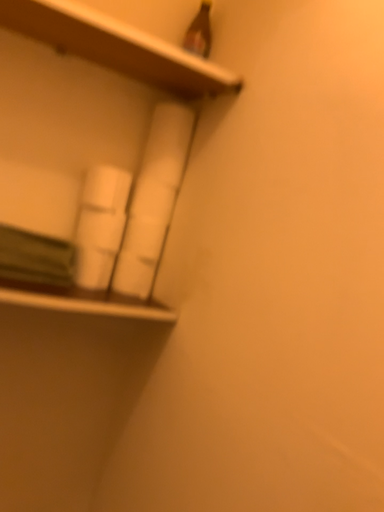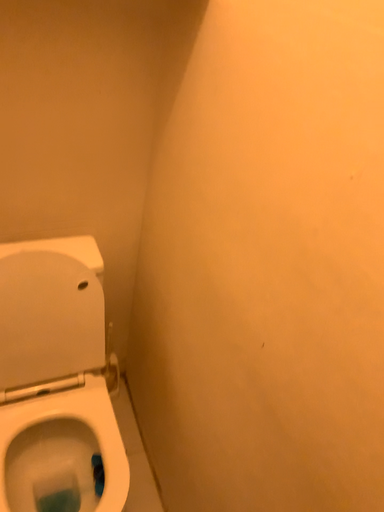
Question: Which way did the camera rotate in the video?

Choices:
 (A) rotated downward
 (B) rotated upward

Answer: (A)